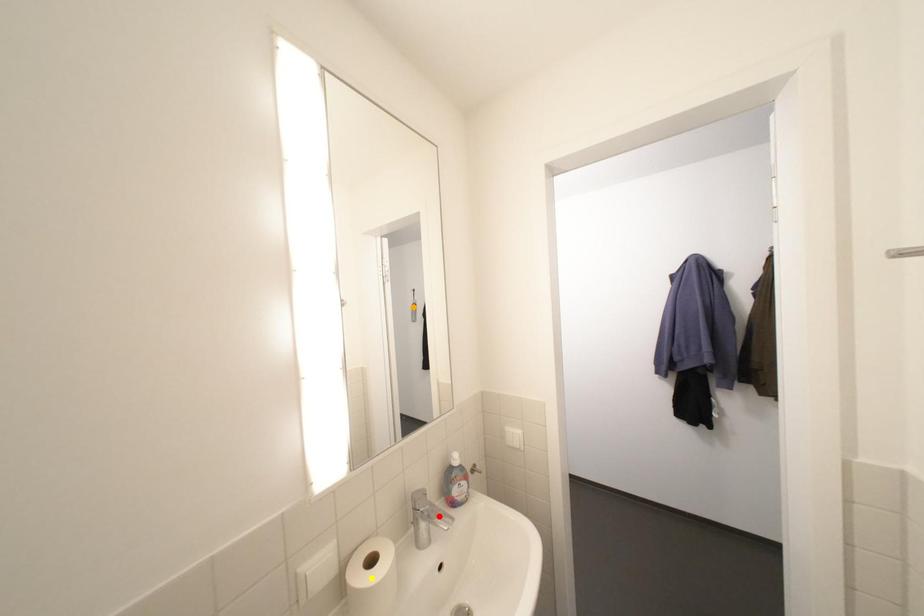
Order these from nearest to farthest:
A) yellow point
B) red point
C) orange point

yellow point, red point, orange point